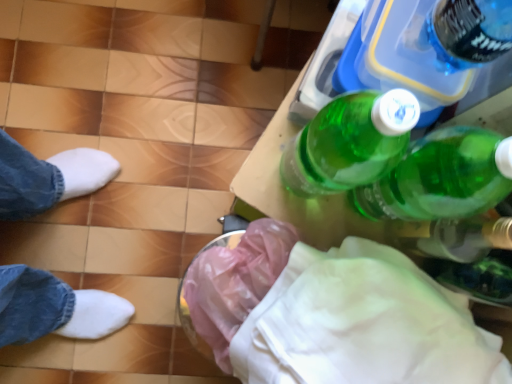
Question: Is the surface of white fabric at lower right in direct contact with pink plastic bag at lower center?

Choices:
 (A) yes
 (B) no

Answer: (B)

Question: From the image's perspective, does white fabric at lower right appear higher than pink plastic bag at lower center?

Choices:
 (A) yes
 (B) no

Answer: (B)

Question: Is white fabric at lower right further to the viewer compared to pink plastic bag at lower center?

Choices:
 (A) yes
 (B) no

Answer: (B)

Question: Can pink plastic bag at lower center be found inside white fabric at lower right?

Choices:
 (A) yes
 (B) no

Answer: (B)

Question: Is white fabric at lower right at the left side of pink plastic bag at lower center?

Choices:
 (A) yes
 (B) no

Answer: (B)

Question: Does white fabric at lower right turn towards pink plastic bag at lower center?

Choices:
 (A) yes
 (B) no

Answer: (B)

Question: Can you confirm if transparent plastic bottle at lower right is shorter than pink plastic bag at lower center?

Choices:
 (A) no
 (B) yes

Answer: (A)

Question: Is transparent plastic bottle at lower right smaller than pink plastic bag at lower center?

Choices:
 (A) no
 (B) yes

Answer: (B)

Question: Can you confirm if transparent plastic bottle at lower right is bigger than pink plastic bag at lower center?

Choices:
 (A) yes
 (B) no

Answer: (B)

Question: Is transparent plastic bottle at lower right facing towards pink plastic bag at lower center?

Choices:
 (A) yes
 (B) no

Answer: (B)

Question: Is transparent plastic bottle at lower right not within pink plastic bag at lower center?

Choices:
 (A) no
 (B) yes

Answer: (B)

Question: Can you confirm if transparent plastic bottle at lower right is positioned to the left of pink plastic bag at lower center?

Choices:
 (A) no
 (B) yes

Answer: (A)

Question: From a real-world perspective, is green plastic bottle at upper right located higher than transparent plastic bottle at lower right?

Choices:
 (A) yes
 (B) no

Answer: (A)